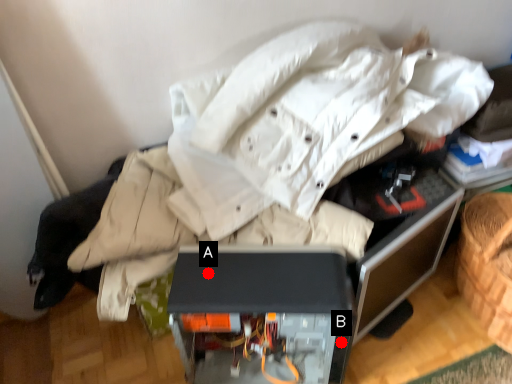
Question: Two points are circled on the image, labeled by A and B beside each circle. Which of the following is the closest to the observer?

Choices:
 (A) A is closer
 (B) B is closer

Answer: (A)